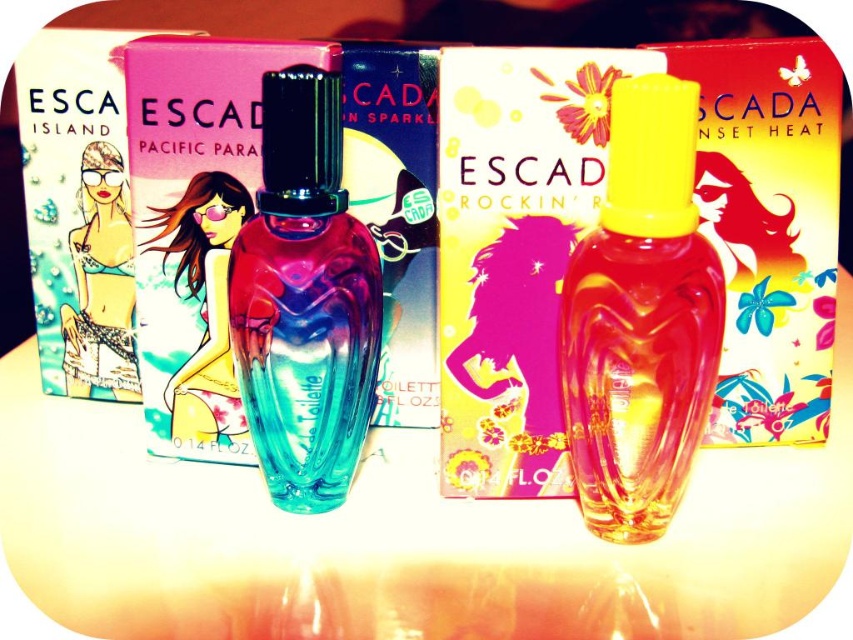
You are a customer at a perfume store and see the translucent glass perfume at center and the pink fabric bikini at center displayed together. Which item is placed on top of the other?

The translucent glass perfume at center is positioned over the pink fabric bikini at center.

You are looking at the image of Escada perfume bottles and their packaging. There is a translucent glass perfume at center and a pink fabric bikini at center. Which one is positioned to the right?

The translucent glass perfume at center is positioned to the right of the pink fabric bikini at center.